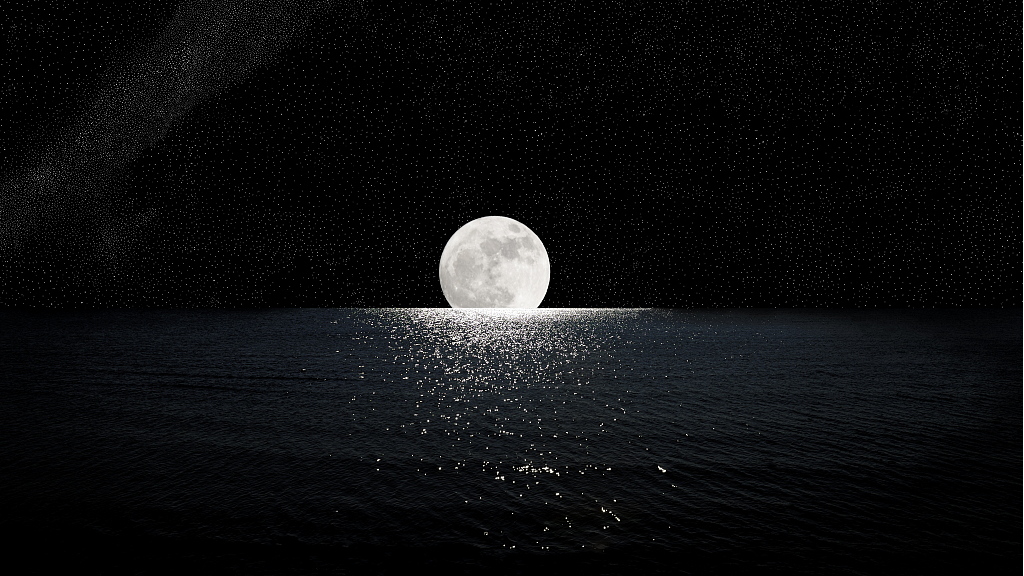
You are a GUI agent. You are given a task and a screenshot of the screen. Output one action in this format:
    pyautogui.click(x=<x>, y=<y>)
    Task: Click on the light
    The width and height of the screenshot is (1024, 576).
    Given the screenshot: What is the action you would take?
    pyautogui.click(x=510, y=316)